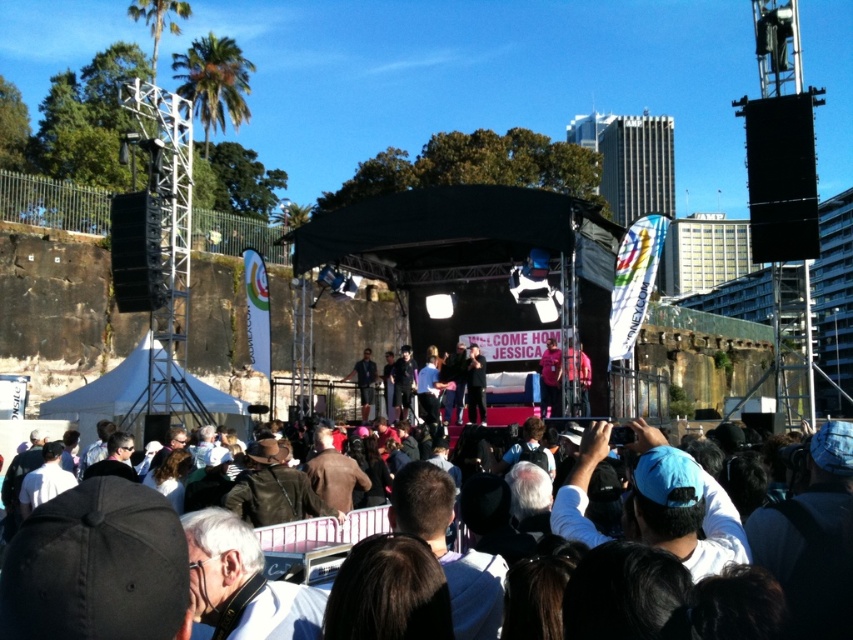
Question: Is the position of dark brown leather jacket at center less distant than that of pink fabric at stage center?

Choices:
 (A) no
 (B) yes

Answer: (B)

Question: Which object appears farthest from the camera in this image?

Choices:
 (A) dark brown leather jacket at center
 (B) pink fabric at stage center

Answer: (B)

Question: Does dark brown leather jacket at center appear on the right side of pink fabric at stage center?

Choices:
 (A) yes
 (B) no

Answer: (B)

Question: Which point is closer to the camera?

Choices:
 (A) dark brown leather jacket at center
 (B) pink fabric at stage center

Answer: (A)

Question: In this image, where is dark brown leather jacket at center located relative to pink fabric at stage center?

Choices:
 (A) right
 (B) left

Answer: (B)